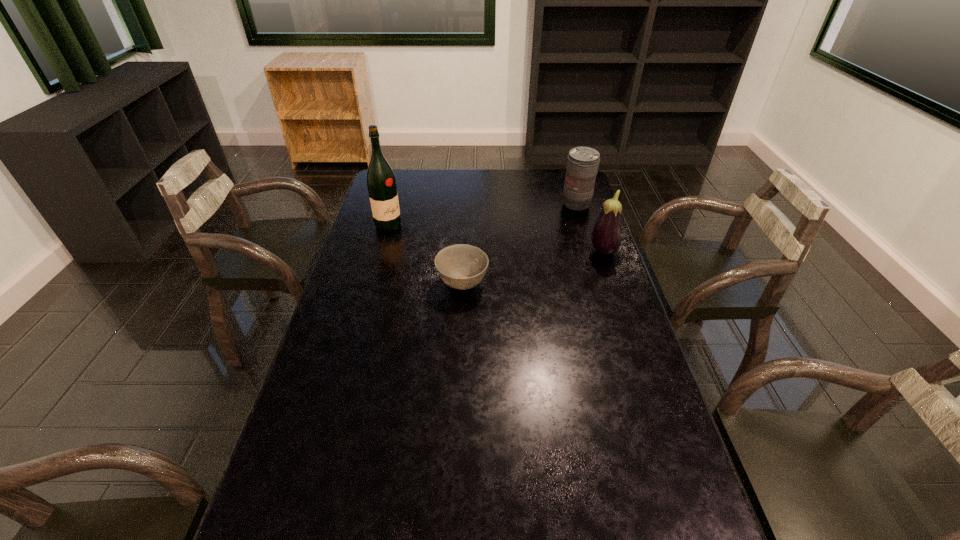
You are a GUI agent. You are given a task and a screenshot of the screen. Output one action in this format:
    pyautogui.click(x=<x>, y=<y>)
    Task: Click on the vacant region located 0.250m on the side of the telephoto lens where the control switches are located
    The width and height of the screenshot is (960, 540).
    Given the screenshot: What is the action you would take?
    point(547,245)

This screenshot has width=960, height=540. I want to click on free space located on the front-facing side of the leftmost object, so [441, 241].

Where is `blank space located 0.240m on the front-facing side of the leftmost object`? Image resolution: width=960 pixels, height=540 pixels. blank space located 0.240m on the front-facing side of the leftmost object is located at coordinates (455, 246).

You are a GUI agent. You are given a task and a screenshot of the screen. Output one action in this format:
    pyautogui.click(x=<x>, y=<y>)
    Task: Click on the free space located on the front-facing side of the leftmost object
    
    Given the screenshot: What is the action you would take?
    [x=468, y=250]

The width and height of the screenshot is (960, 540). I want to click on object that is positioned at the left edge, so click(x=381, y=182).

The width and height of the screenshot is (960, 540). Identify the location of eggplant located at the right edge. (606, 237).

The height and width of the screenshot is (540, 960). What are the coordinates of `telephoto lens located in the right edge section of the desktop` in the screenshot? It's located at (582, 165).

In order to click on free location at the far edge in this screenshot , I will do `click(424, 183)`.

Image resolution: width=960 pixels, height=540 pixels. Identify the location of vacant space at the near edge of the desktop. (548, 502).

Locate an element on the screen. vacant region at the left edge of the desktop is located at coordinates (348, 267).